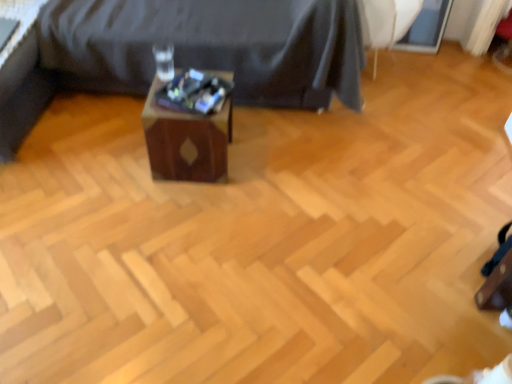
Question: Could you tell me if wooden box at center is turned towards white fabric swivel chair at upper right?

Choices:
 (A) yes
 (B) no

Answer: (B)

Question: Can you confirm if wooden box at center is smaller than white fabric swivel chair at upper right?

Choices:
 (A) yes
 (B) no

Answer: (A)

Question: Can you confirm if wooden box at center is thinner than white fabric swivel chair at upper right?

Choices:
 (A) yes
 (B) no

Answer: (A)

Question: Is wooden box at center at the left side of white fabric swivel chair at upper right?

Choices:
 (A) no
 (B) yes

Answer: (B)

Question: Can you confirm if wooden box at center is positioned to the right of white fabric swivel chair at upper right?

Choices:
 (A) no
 (B) yes

Answer: (A)

Question: Do you think white fabric swivel chair at upper right is within wooden box at center, or outside of it?

Choices:
 (A) outside
 (B) inside

Answer: (A)

Question: Is white fabric swivel chair at upper right wider or thinner than wooden box at center?

Choices:
 (A) thin
 (B) wide

Answer: (B)

Question: From the image's perspective, relative to wooden box at center, is white fabric swivel chair at upper right above or below?

Choices:
 (A) below
 (B) above

Answer: (B)

Question: In terms of height, does white fabric swivel chair at upper right look taller or shorter compared to wooden box at center?

Choices:
 (A) tall
 (B) short

Answer: (A)

Question: Is wooden box at center taller or shorter than wooden side table at center?

Choices:
 (A) short
 (B) tall

Answer: (A)

Question: Is wooden box at center bigger or smaller than wooden side table at center?

Choices:
 (A) big
 (B) small

Answer: (B)

Question: Relative to wooden side table at center, is wooden box at center in front or behind?

Choices:
 (A) front
 (B) behind

Answer: (A)

Question: Do you think wooden box at center is within wooden side table at center, or outside of it?

Choices:
 (A) outside
 (B) inside

Answer: (A)

Question: From their relative heights in the image, would you say wooden side table at center is taller or shorter than white fabric swivel chair at upper right?

Choices:
 (A) short
 (B) tall

Answer: (B)

Question: Considering the relative positions of wooden side table at center and white fabric swivel chair at upper right in the image provided, is wooden side table at center to the left or to the right of white fabric swivel chair at upper right?

Choices:
 (A) left
 (B) right

Answer: (A)